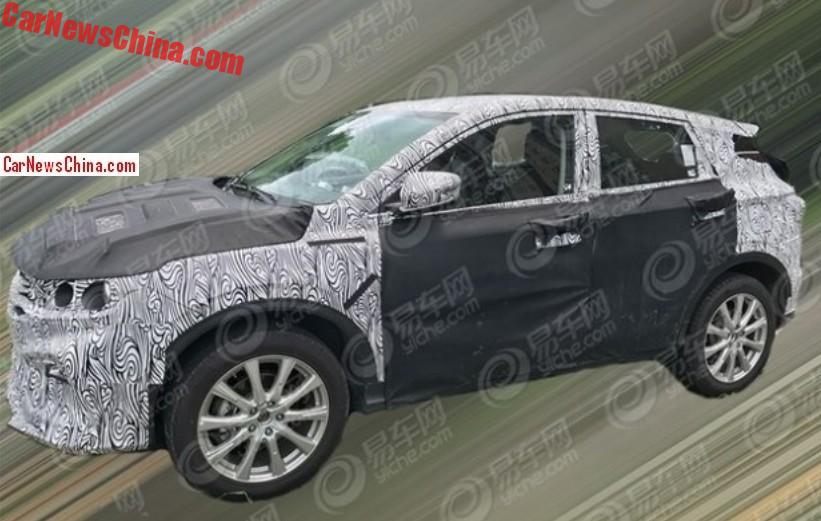
Locate an element on the screen. hood is located at coordinates (159, 234).